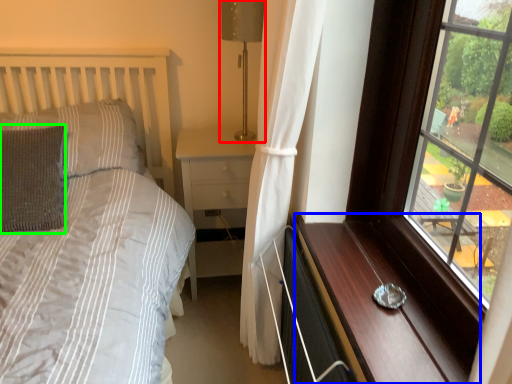
Question: Based on their relative distances, which object is nearer to table lamp (highlighted by a red box)? Choose from dresser (highlighted by a blue box) and pillow (highlighted by a green box).

Choices:
 (A) dresser
 (B) pillow

Answer: (B)